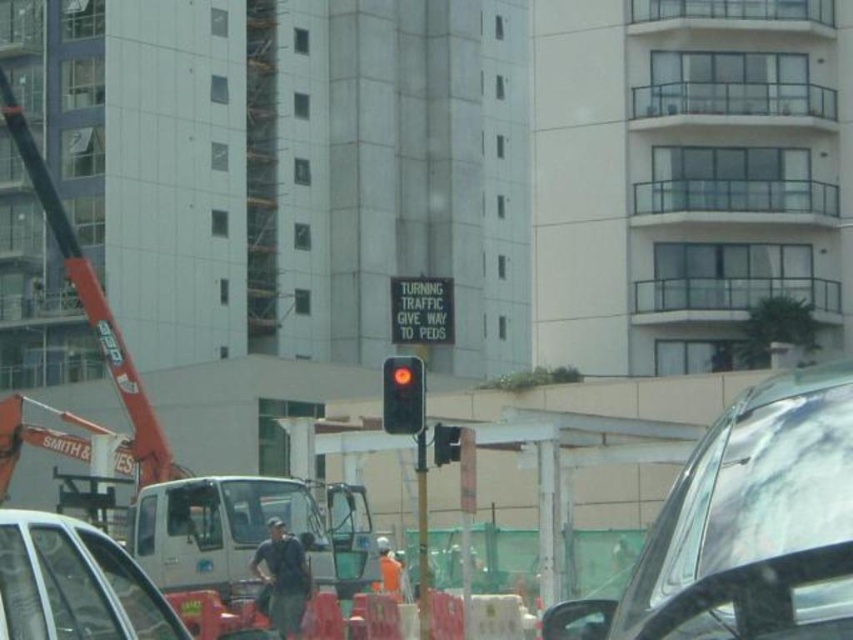
Between dark blue shirt at center and orange fabric man at center, which one appears on the left side from the viewer's perspective?

dark blue shirt at center is more to the left.

Can you confirm if dark blue shirt at center is positioned below orange fabric man at center?

Incorrect, dark blue shirt at center is not positioned below orange fabric man at center.

Identify the location of dark blue shirt at center. The height and width of the screenshot is (640, 853). (281, 579).

Does shiny silver car at center appear on the right side of orange fabric man at center?

Yes, shiny silver car at center is to the right of orange fabric man at center.

Which is more to the left, shiny silver car at center or orange fabric man at center?

orange fabric man at center

You are a GUI agent. You are given a task and a screenshot of the screen. Output one action in this format:
    pyautogui.click(x=<x>, y=<y>)
    Task: Click on the shiny silver car at center
    
    Given the screenshot: What is the action you would take?
    (740, 497)

The height and width of the screenshot is (640, 853). I want to click on shiny silver car at center, so click(740, 497).

Is shiny silver car at center thinner than black glass traffic light at center?

In fact, shiny silver car at center might be wider than black glass traffic light at center.

Measure the distance between shiny silver car at center and black glass traffic light at center.

7.48 meters

At what (x,y) coordinates should I click in order to perform the action: click on shiny silver car at center. Please return your answer as a coordinate pair (x, y). Looking at the image, I should click on (740, 497).